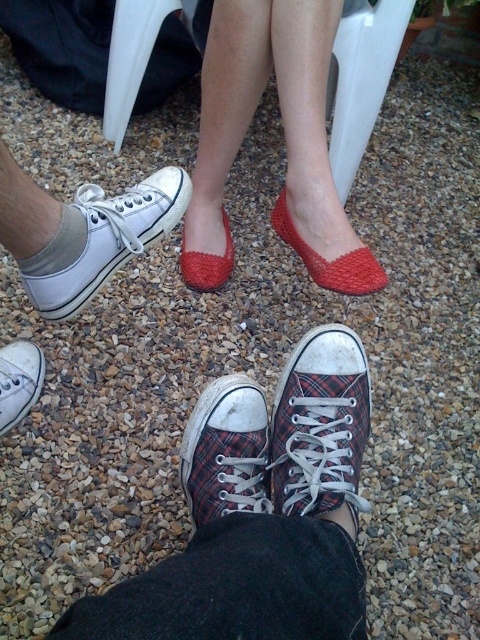
Question: Is red knitted flats at center below plaid fabric shoe at lower center?

Choices:
 (A) yes
 (B) no

Answer: (B)

Question: Which point is closer to the camera?

Choices:
 (A) (58, 243)
 (B) (230, 257)

Answer: (A)

Question: Which of these objects is positioned closest to the plaid canvas shoe at lower center?

Choices:
 (A) red knitted sandal at center
 (B) white canvas shoe at lower left
 (C) red knitted slipper at center

Answer: (B)

Question: Does plaid canvas sneakers at center lie in front of red knitted slipper at center?

Choices:
 (A) yes
 (B) no

Answer: (A)

Question: Which point is farther from the camera taking this photo?

Choices:
 (A) (356, 401)
 (B) (236, 385)
 (C) (211, 268)

Answer: (C)

Question: Does white canvas sneaker at lower left come behind red knitted sandal at center?

Choices:
 (A) yes
 (B) no

Answer: (B)